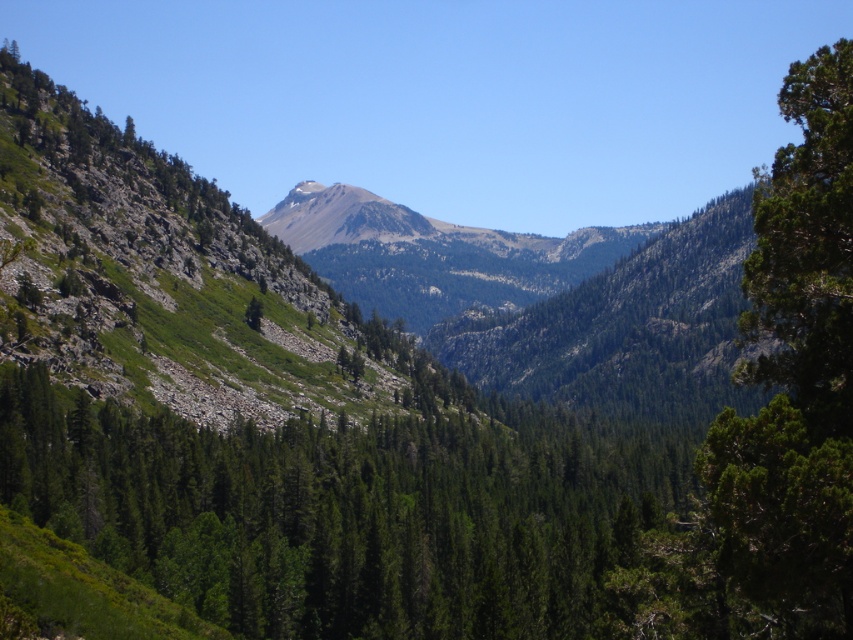
Is point (302, 600) positioned before point (786, 342)?

No, it is not.

Does green matte tree at center appear over green textured tree at right?

No.

Find the location of a particular element. The image size is (853, 640). green matte tree at center is located at coordinates (344, 513).

The height and width of the screenshot is (640, 853). Identify the location of green matte tree at center. (344, 513).